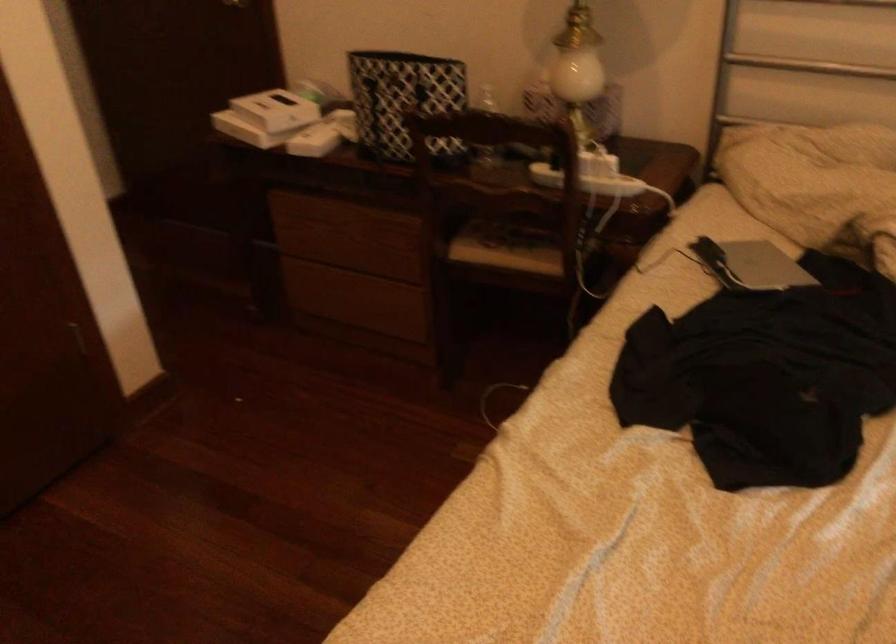
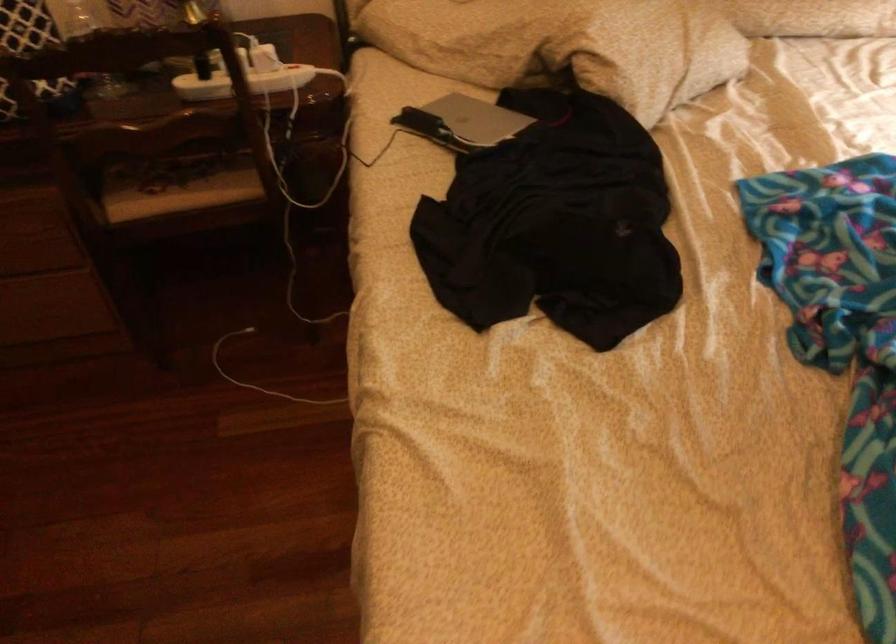
Locate, in the second image, the point that corresponds to [581,322] in the first image.

(291, 240)